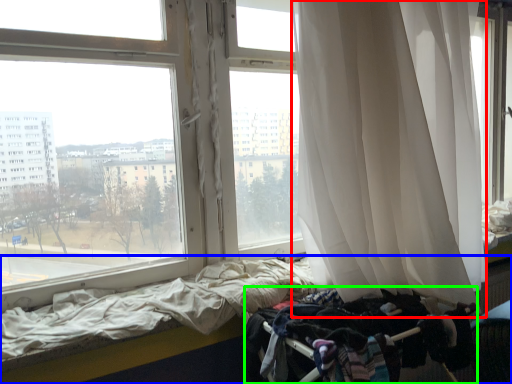
Question: Based on their relative distances, which object is farther from curtain (highlighted by a red box)? Choose from bed (highlighted by a blue box) and baby carriage (highlighted by a green box).

Choices:
 (A) bed
 (B) baby carriage

Answer: (A)